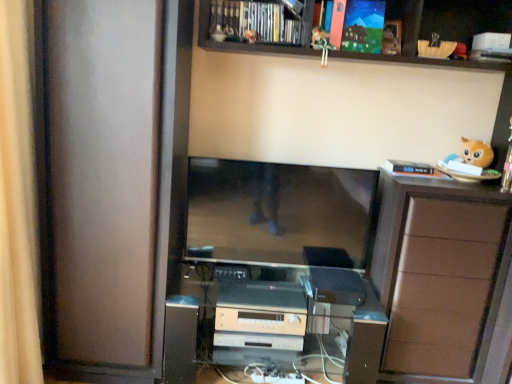
Question: Is matte brown screen door at left oriented towards beige fabric curtain at left?

Choices:
 (A) yes
 (B) no

Answer: (B)

Question: Is matte brown screen door at left in front of beige fabric curtain at left?

Choices:
 (A) no
 (B) yes

Answer: (A)

Question: Does matte brown screen door at left have a greater width compared to beige fabric curtain at left?

Choices:
 (A) yes
 (B) no

Answer: (A)

Question: From the image's perspective, is matte brown screen door at left under beige fabric curtain at left?

Choices:
 (A) no
 (B) yes

Answer: (A)

Question: Considering the relative sizes of matte brown screen door at left and beige fabric curtain at left in the image provided, is matte brown screen door at left shorter than beige fabric curtain at left?

Choices:
 (A) yes
 (B) no

Answer: (B)

Question: From the image's perspective, is wooden at upper center above or below satin silver stereo at center?

Choices:
 (A) above
 (B) below

Answer: (A)

Question: Considering the positions of wooden at upper center and satin silver stereo at center in the image, is wooden at upper center taller or shorter than satin silver stereo at center?

Choices:
 (A) short
 (B) tall

Answer: (A)

Question: Looking at their shapes, would you say wooden at upper center is wider or thinner than satin silver stereo at center?

Choices:
 (A) wide
 (B) thin

Answer: (B)

Question: From a real-world perspective, is wooden at upper center physically located above or below satin silver stereo at center?

Choices:
 (A) below
 (B) above

Answer: (B)

Question: Does point (218, 342) appear closer or farther from the camera than point (368, 307)?

Choices:
 (A) closer
 (B) farther

Answer: (B)

Question: From the image's perspective, is beige plastic stereo at lower center, which is counted as the first appliance, starting from the left, above or below satin silver stereo at center?

Choices:
 (A) below
 (B) above

Answer: (B)

Question: From a real-world perspective, is beige plastic stereo at lower center, the second appliance viewed from the right, physically located above or below satin silver stereo at center?

Choices:
 (A) below
 (B) above

Answer: (B)

Question: Relative to satin silver stereo at center, is beige plastic stereo at lower center, the second appliance viewed from the right, in front or behind?

Choices:
 (A) behind
 (B) front

Answer: (A)

Question: Visually, is matte black monitor at center positioned to the left or to the right of fluffy orange plush at upper right, placed as the second toy when sorted from left to right?

Choices:
 (A) left
 (B) right

Answer: (A)

Question: Looking at their shapes, would you say matte black monitor at center is wider or thinner than fluffy orange plush at upper right, which is counted as the 1th toy, starting from the bottom?

Choices:
 (A) wide
 (B) thin

Answer: (B)